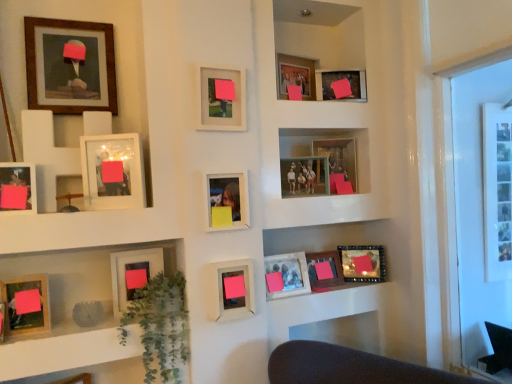
You are a GUI agent. You are given a task and a screenshot of the screen. Output one action in this format:
    pyautogui.click(x=<x>, y=<y>)
    Task: Click on the matte wooden picture frame at lower left, the 14th picture frame when ordered from right to left
    
    Given the screenshot: What is the action you would take?
    pyautogui.click(x=27, y=303)

What is the approximate width of matte glass picture frame at center, which appears as the seventh picture frame when viewed from the right?

The width of matte glass picture frame at center, which appears as the seventh picture frame when viewed from the right, is 6.17 centimeters.

How much space does wooden photo frame at upper center, the fourteenth picture frame viewed from the left, occupy vertically?

It is 13.89 centimeters.

The width and height of the screenshot is (512, 384). Describe the element at coordinates (340, 80) in the screenshot. I see `wooden photo frame at upper center, the fourteenth picture frame viewed from the left` at that location.

What is the approximate width of matte glass photo frame at upper left, acting as the 12th picture frame starting from the right?

2.34 inches.

The image size is (512, 384). What are the coordinates of `matte wooden picture frame at lower left, the 14th picture frame when ordered from right to left` in the screenshot? It's located at (27, 303).

Does matte glass photo frame at upper left, acting as the 12th picture frame starting from the right, contain matte wooden picture frame at lower left, the fifteenth picture frame positioned from the right?

Result: No, matte glass photo frame at upper left, acting as the 12th picture frame starting from the right, does not contain matte wooden picture frame at lower left, the fifteenth picture frame positioned from the right.

Considering the relative sizes of matte glass photo frame at upper left, the fourth picture frame when ordered from left to right, and matte wooden picture frame at lower left, the first picture frame viewed from the left, in the image provided, is matte glass photo frame at upper left, the fourth picture frame when ordered from left to right, taller than matte wooden picture frame at lower left, the first picture frame viewed from the left,?

Correct, matte glass photo frame at upper left, the fourth picture frame when ordered from left to right, is much taller as matte wooden picture frame at lower left, the first picture frame viewed from the left.

Does point (97, 173) come behind point (11, 202)?

That is True.

At what (x,y) coordinates should I click in order to perform the action: click on picture frame that is the 2nd one when counting downward from the matte glass photo frame at upper left, acting as the 12th picture frame starting from the right (from the image's perspective). Please return your answer as a coordinate pair (x, y). Looking at the image, I should click on (18, 187).

The width and height of the screenshot is (512, 384). I want to click on picture frame that is the 7th one when counting forward from the matte wooden shelf at lower center, so click(27, 303).

Is matte wooden shelf at lower center located within matte wooden picture frame at lower left, the 14th picture frame when ordered from right to left?

That's incorrect, matte wooden shelf at lower center is not inside matte wooden picture frame at lower left, the 14th picture frame when ordered from right to left.

Considering the sizes of objects matte wooden picture frame at lower left, acting as the 2th picture frame starting from the left, and matte wooden shelf at lower center in the image provided, who is shorter, matte wooden picture frame at lower left, acting as the 2th picture frame starting from the left, or matte wooden shelf at lower center?

Standing shorter between the two is matte wooden picture frame at lower left, acting as the 2th picture frame starting from the left.

Considering the positions of objects matte wooden picture frame at lower left, acting as the 2th picture frame starting from the left, and matte wooden shelf at lower center in the image provided, who is more to the right, matte wooden picture frame at lower left, acting as the 2th picture frame starting from the left, or matte wooden shelf at lower center?

From the viewer's perspective, matte wooden shelf at lower center appears more on the right side.

Considering the sizes of objects matte wooden shelf at lower center and matte wooden picture frame at lower left, the first picture frame viewed from the left, in the image provided, who is bigger, matte wooden shelf at lower center or matte wooden picture frame at lower left, the first picture frame viewed from the left,?

matte wooden shelf at lower center.

From a real-world perspective, is matte wooden shelf at lower center located higher than matte wooden picture frame at lower left, the fifteenth picture frame positioned from the right?

Actually, matte wooden shelf at lower center is physically below matte wooden picture frame at lower left, the fifteenth picture frame positioned from the right, in the real world.

From a real-world perspective, starting from the matte wooden shelf at lower center, which picture frame is the 9th one vertically above it? Please provide its 2D coordinates.

[(18, 187)]

Is matte wooden shelf at lower center outside of matte wooden picture frame at lower left, the fifteenth picture frame positioned from the right?

That's correct, matte wooden shelf at lower center is outside of matte wooden picture frame at lower left, the fifteenth picture frame positioned from the right.

Can you see matte wooden shelf at lower center touching green leafy plant at lower left?

They are not placed beside each other.

Image resolution: width=512 pixels, height=384 pixels. I want to click on plant lying above the matte wooden shelf at lower center (from the image's perspective), so click(160, 326).

Is matte wooden shelf at lower center turned away from green leafy plant at lower left?

No, matte wooden shelf at lower center's orientation is not away from green leafy plant at lower left.

Between matte wooden shelf at lower center and green leafy plant at lower left, which one has smaller size?

With smaller size is green leafy plant at lower left.

Looking at this image, which of these two, matte wooden picture frame at lower center, acting as the twelfth picture frame starting from the left, or wooden framed portrait at upper left, which is the third picture frame from left to right, is thinner?

wooden framed portrait at upper left, which is the third picture frame from left to right, is thinner.

Which is further, [313,275] or [93,104]?

The point [313,275] is behind.

Which picture frame is the 6th one when counting from the back of the wooden framed portrait at upper left, the 13th picture frame when ordered from right to left? Please provide its 2D coordinates.

[(324, 269)]

Measure the distance between matte wooden picture frame at lower center, acting as the twelfth picture frame starting from the left, and wooden framed portrait at upper left, the 13th picture frame when ordered from right to left.

matte wooden picture frame at lower center, acting as the twelfth picture frame starting from the left, is 4.07 feet away from wooden framed portrait at upper left, the 13th picture frame when ordered from right to left.

From their relative heights in the image, would you say wooden frame at upper left is taller or shorter than pink matte picture frame at center, which is counted as the tenth picture frame, starting from the right?

Clearly, wooden frame at upper left is taller compared to pink matte picture frame at center, which is counted as the tenth picture frame, starting from the right.

From the image's perspective, is wooden frame at upper left over pink matte picture frame at center, which is counted as the tenth picture frame, starting from the right?

No.

Can you confirm if wooden frame at upper left is wider than pink matte picture frame at center, which is counted as the tenth picture frame, starting from the right?

Yes.

Consider the image. Could you measure the distance between wooden frame at upper left and pink matte picture frame at center, which is counted as the tenth picture frame, starting from the right?

wooden frame at upper left and pink matte picture frame at center, which is counted as the tenth picture frame, starting from the right, are 39.75 centimeters apart from each other.

Is green leafy plant at lower left oriented towards matte wooden picture frame at lower left, the fifteenth picture frame positioned from the right?

No, green leafy plant at lower left is not turned towards matte wooden picture frame at lower left, the fifteenth picture frame positioned from the right.

Who is more distant, green leafy plant at lower left or matte wooden picture frame at lower left, the fifteenth picture frame positioned from the right?

green leafy plant at lower left is behind.

From the image's perspective, is green leafy plant at lower left located above or below matte wooden picture frame at lower left, the fifteenth picture frame positioned from the right?

green leafy plant at lower left is below matte wooden picture frame at lower left, the fifteenth picture frame positioned from the right.

Identify the location of plant below the matte wooden picture frame at lower left, the first picture frame viewed from the left (from the image's perspective). This screenshot has width=512, height=384. pos(160,326).

Locate an element on the screen. The image size is (512, 384). the 1st picture frame directly beneath the matte glass photo frame at upper left, the fourth picture frame when ordered from left to right (from a real-world perspective) is located at coordinates (18, 187).

Locate an element on the screen. The width and height of the screenshot is (512, 384). shelf behind the matte wooden picture frame at lower left, the 14th picture frame when ordered from right to left is located at coordinates (320, 308).

Looking at the image, which one is located further to matte wooden shelf at lower center, matte plastic photo frame at center, the ninth picture frame positioned from the right, or pink matte picture frame at center, arranged as the 6th picture frame when viewed from the left?

pink matte picture frame at center, arranged as the 6th picture frame when viewed from the left, is positioned further to the anchor matte wooden shelf at lower center.

Considering their positions, is matte wooden picture frame at lower left, which is counted as the eleventh picture frame, starting from the right, positioned closer to matte glass photo frame at upper left, the fourth picture frame when ordered from left to right, than matte wooden picture frame at lower center, acting as the twelfth picture frame starting from the left?

matte wooden picture frame at lower left, which is counted as the eleventh picture frame, starting from the right, is positioned closer to the anchor matte glass photo frame at upper left, the fourth picture frame when ordered from left to right.

Looking at the image, which one is located closer to wooden frame at center, the 3th picture frame positioned from the right, wooden photo frame at upper center, the 10th picture frame when ordered from left to right, or matte wooden picture frame at lower left, which is counted as the eleventh picture frame, starting from the right?

wooden photo frame at upper center, the 10th picture frame when ordered from left to right, lies closer to wooden frame at center, the 3th picture frame positioned from the right, than the other object.

Considering their positions, is pink matte picture frame at center, which is counted as the tenth picture frame, starting from the right, positioned further to matte plastic photo frame at center, the 7th picture frame when ordered from left to right, than wooden frame at center, the 3th picture frame positioned from the right?

wooden frame at center, the 3th picture frame positioned from the right, lies further to matte plastic photo frame at center, the 7th picture frame when ordered from left to right, than the other object.

Considering their positions, is pink matte picture frame at center, arranged as the 6th picture frame when viewed from the left, positioned closer to wooden frame at upper left than matte wooden picture frame at lower left, the 14th picture frame when ordered from right to left?

Among the two, pink matte picture frame at center, arranged as the 6th picture frame when viewed from the left, is located nearer to wooden frame at upper left.

Considering their positions, is matte wooden picture frame at lower left, which is the fifth picture frame from left to right, positioned closer to green leafy plant at lower left than wooden framed portrait at upper left, which is the third picture frame from left to right?

matte wooden picture frame at lower left, which is the fifth picture frame from left to right.

From the image, which object appears to be nearer to wooden frame at upper left, matte wooden picture frame at lower center, acting as the twelfth picture frame starting from the left, or green leafy plant at lower left?

Based on the image, green leafy plant at lower left appears to be nearer to wooden frame at upper left.

Estimate the real-world distances between objects in this image. Which object is further from matte glass picture frame at center, the ninth picture frame from the left, wooden photo frame at upper center, the 10th picture frame when ordered from left to right, or matte wooden picture frame at lower left, which is counted as the eleventh picture frame, starting from the right?

Based on the image, wooden photo frame at upper center, the 10th picture frame when ordered from left to right, appears to be further to matte glass picture frame at center, the ninth picture frame from the left.

Where is `bookcase between wooden photo frame at upper center, the fourteenth picture frame viewed from the left, and green leafy plant at lower left in the up-down direction`? bookcase between wooden photo frame at upper center, the fourteenth picture frame viewed from the left, and green leafy plant at lower left in the up-down direction is located at coordinates (115, 54).

The height and width of the screenshot is (384, 512). I want to click on shelf located between matte wooden picture frame at lower left, the fifteenth picture frame positioned from the right, and wooden photo frame at upper center, which ranks as the second picture frame in right-to-left order, in the left-right direction, so click(x=320, y=308).

Where is `plant between wooden photo frame at upper center, the 10th picture frame when ordered from left to right, and matte wooden shelf at lower center in the up-down direction`? plant between wooden photo frame at upper center, the 10th picture frame when ordered from left to right, and matte wooden shelf at lower center in the up-down direction is located at coordinates (160, 326).

Locate an element on the screen. shelf between wooden framed portrait at upper left, the 13th picture frame when ordered from right to left, and wooden frame at center, the 3th picture frame positioned from the right, in the horizontal direction is located at coordinates 320,308.